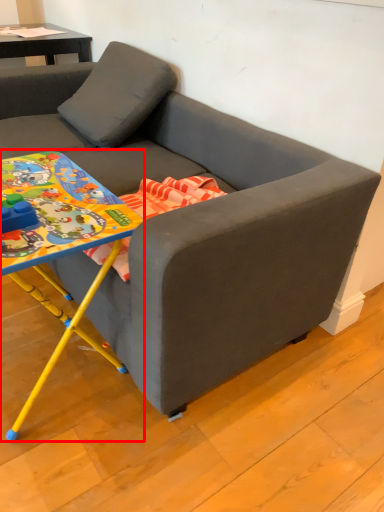
Question: From the image's perspective, what is the correct spatial relationship of table (annotated by the red box) in relation to studio couch?

Choices:
 (A) below
 (B) above

Answer: (A)